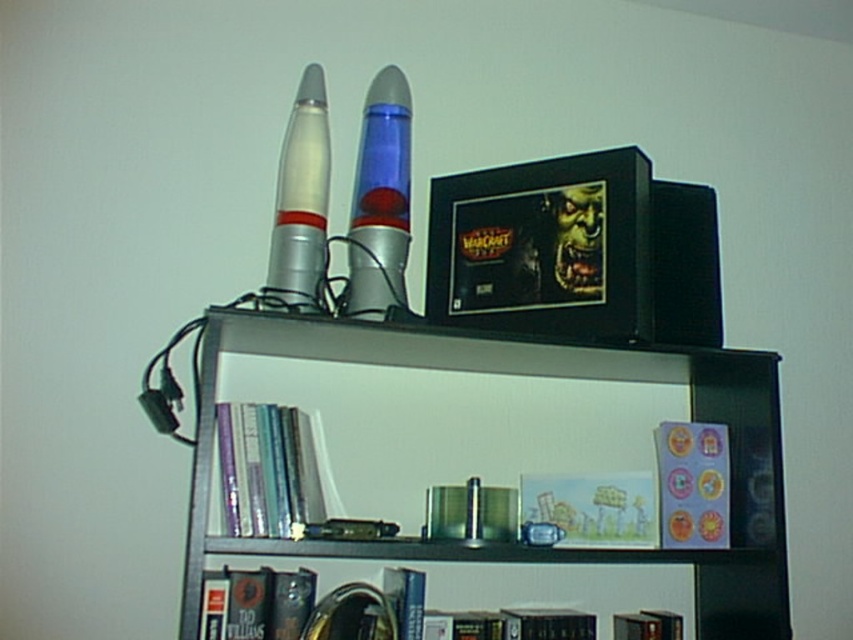
You are standing in front of the bookshelf and want to place a new item between the two points, point (314, 96) and point (631, 630). Which point should you start from to ensure the item is placed closer to the front of the bookshelf?

You should start from point (314, 96) because it is in front of point (631, 630), so placing the item closer to this point will keep it nearer to the front of the bookshelf.